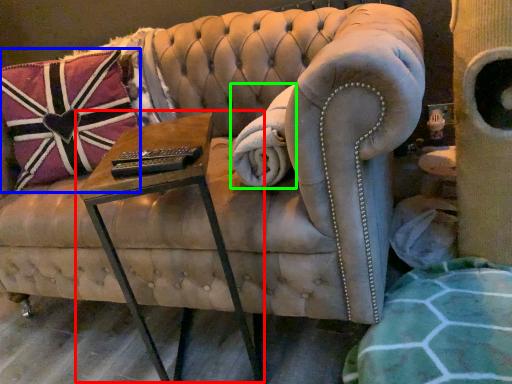
Question: Which object is positioned closest to table (highlighted by a red box)? Select from pillow (highlighted by a blue box) and blanket (highlighted by a green box).

Choices:
 (A) pillow
 (B) blanket

Answer: (B)